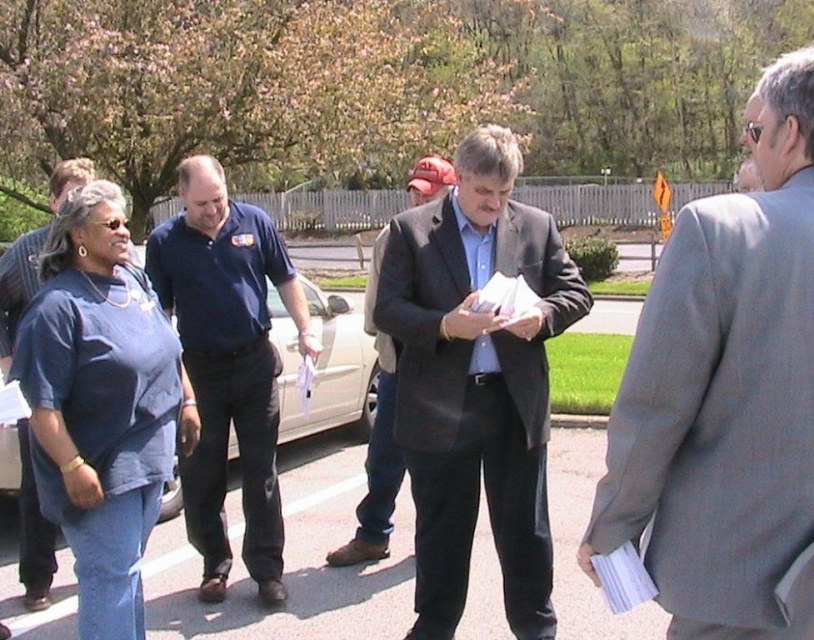
Question: Does matte blue shirt at center have a lesser width compared to blue cotton shirt at center?

Choices:
 (A) no
 (B) yes

Answer: (B)

Question: Which object appears farthest from the camera in this image?

Choices:
 (A) matte blue shirt at center
 (B) dark gray wool coat at center

Answer: (B)

Question: Which object is positioned farthest from the dark gray wool coat at center?

Choices:
 (A) matte blue shirt at center
 (B) dark gray suit at center
 (C) blue cotton shirt at center
 (D) gray wool suit at right

Answer: (D)

Question: In this image, where is gray wool suit at right located relative to dark gray suit at center?

Choices:
 (A) above
 (B) below

Answer: (A)

Question: Where is gray wool suit at right located in relation to dark gray suit at center in the image?

Choices:
 (A) left
 (B) right

Answer: (B)

Question: Based on their relative distances, which object is nearer to the gray wool suit at right?

Choices:
 (A) blue cotton shirt at center
 (B) dark gray suit at center
 (C) matte blue shirt at center

Answer: (B)